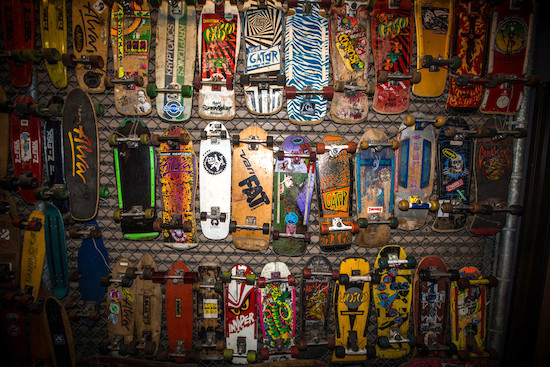
Identify the location of art. Image resolution: width=550 pixels, height=367 pixels. (314, 57).